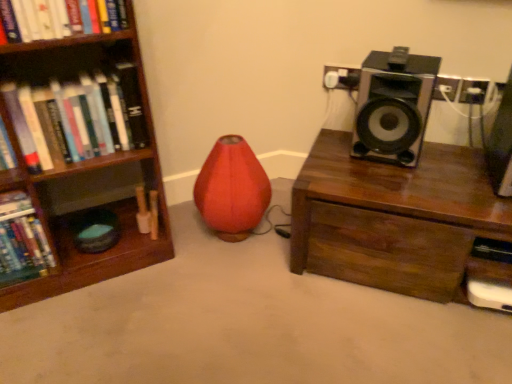
This screenshot has width=512, height=384. I want to click on vacant point above brown wooden chest at right (from a real-world perspective), so click(x=438, y=172).